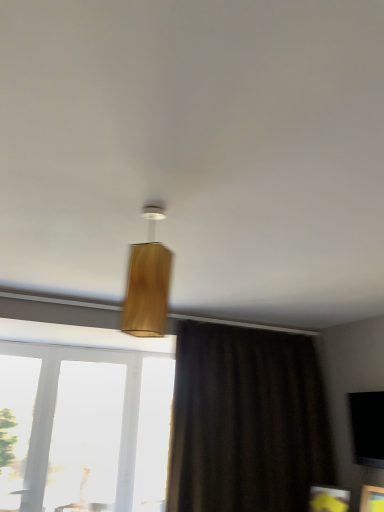
Question: Would you say transparent glass window screen at lower right is inside or outside transparent glass window at lower left, the second window positioned from the left?

Choices:
 (A) outside
 (B) inside

Answer: (A)

Question: Does point (362, 435) appear closer or farther from the camera than point (57, 357)?

Choices:
 (A) farther
 (B) closer

Answer: (B)

Question: Considering the real-world distances, which object is closest to the wooden lampshade at center?

Choices:
 (A) brown matte curtain at lower right
 (B) transparent glass window at lower left, the 1th window from the left
 (C) transparent glass window at lower left, the second window positioned from the left
 (D) transparent glass window screen at lower right
 (E) transparent glass window at left, the third window positioned from the left

Answer: (A)

Question: Estimate the real-world distances between objects in this image. Which object is closer to the transparent glass window at left, placed as the 1th window when sorted from right to left?

Choices:
 (A) wooden lampshade at center
 (B) transparent glass window at lower left, marked as the third window in a right-to-left arrangement
 (C) transparent glass window at lower left, which is the second window in right-to-left order
 (D) brown matte curtain at lower right
 (E) transparent glass window screen at lower right

Answer: (C)